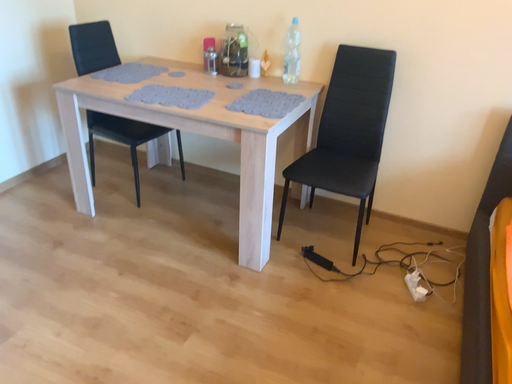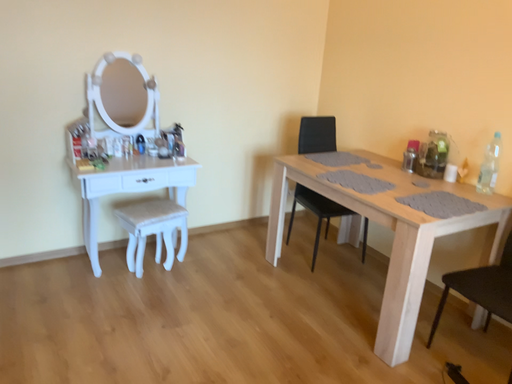
Question: Which way did the camera rotate in the video?

Choices:
 (A) rotated upward
 (B) rotated downward

Answer: (A)